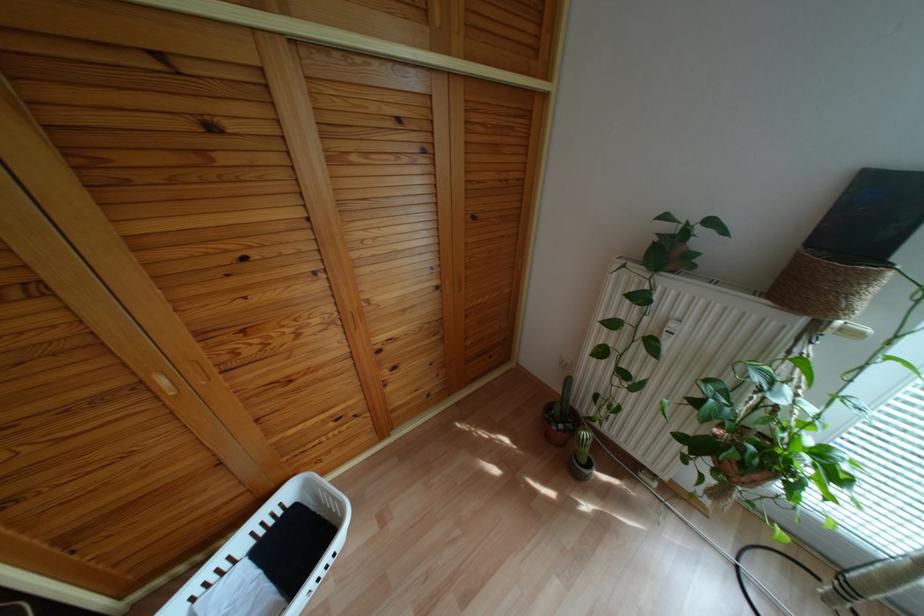
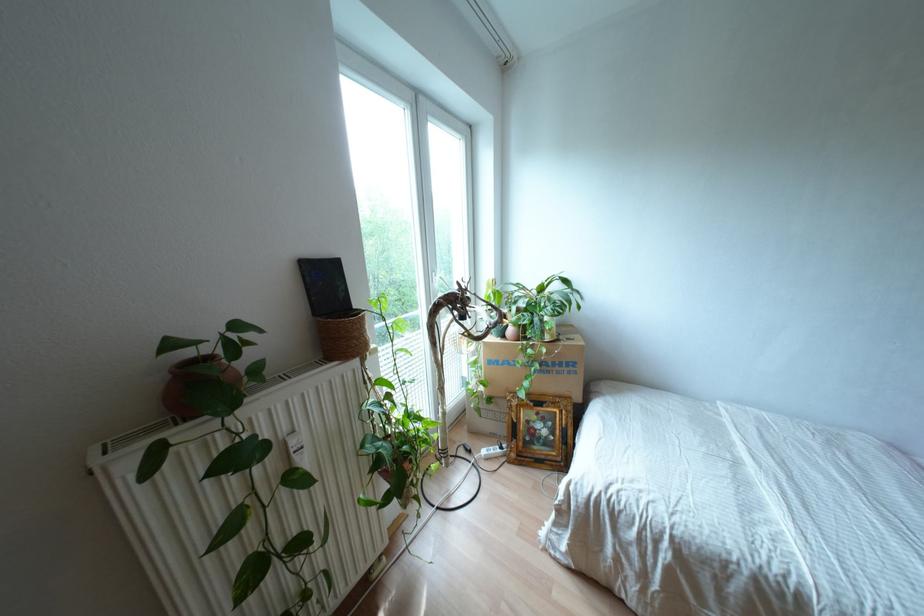
Where in the second image is the point corresponding to point 672,333 from the first image?

(301, 448)